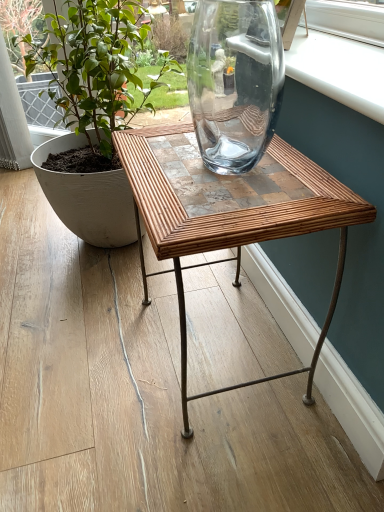
The image size is (384, 512). I want to click on free space in front of green matte plant at left, so click(x=87, y=308).